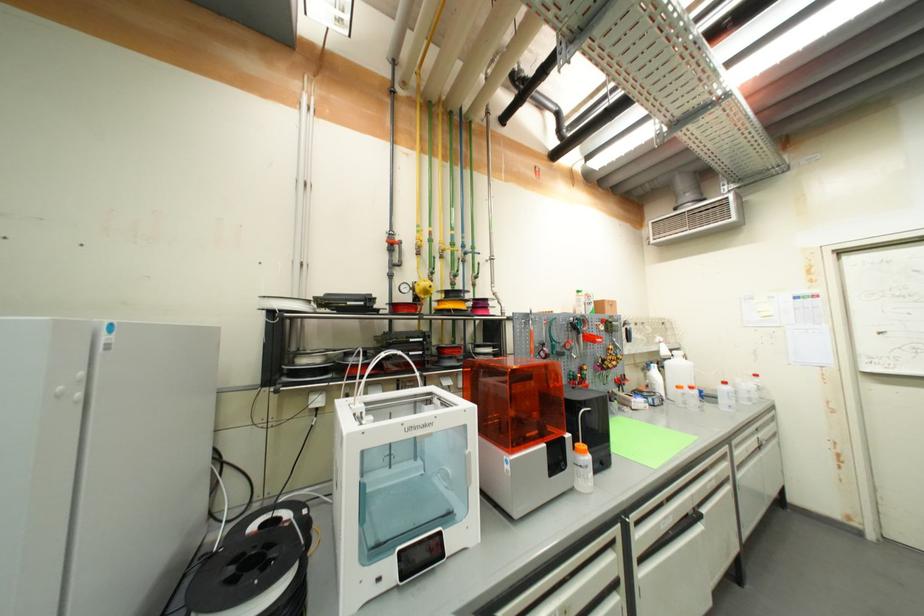
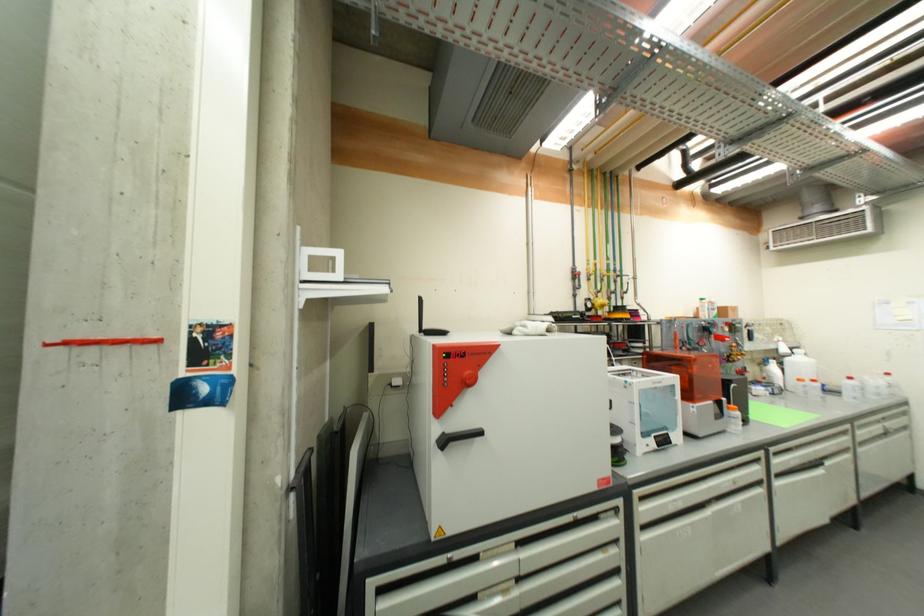
Find the pixel in the second image that matches point (589, 454) in the first image.

(739, 411)